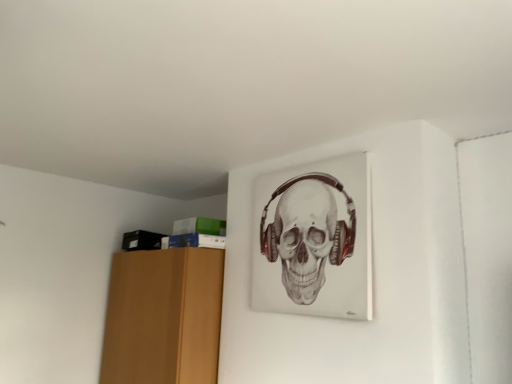
Question: Should I look upward or downward to see gray matte skull at upper center?

Choices:
 (A) down
 (B) up

Answer: (A)